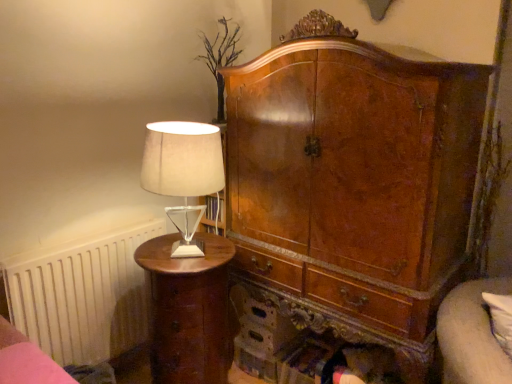
This screenshot has width=512, height=384. What do you see at coordinates (184, 174) in the screenshot? I see `satin beige lampshade at left` at bounding box center [184, 174].

Measure the distance between point (467, 356) and camera.

Point (467, 356) and camera are 3.83 feet apart from each other.

Locate an element on the screen. Image resolution: width=512 pixels, height=384 pixels. velvet beige couch at lower right is located at coordinates (472, 335).

What is the approximate height of white matte radiator at left?

white matte radiator at left is 77.67 centimeters tall.

At what (x,y) coordinates should I click in order to perform the action: click on satin beige lampshade at left. Please return your answer as a coordinate pair (x, y). The height and width of the screenshot is (384, 512). Looking at the image, I should click on (184, 174).

Is white matte radiator at left not close to satin beige lampshade at left?

white matte radiator at left is actually quite close to satin beige lampshade at left.

The image size is (512, 384). Identify the location of radiator that is on the left side of satin beige lampshade at left. (84, 296).

From the image's perspective, between white matte radiator at left and satin beige lampshade at left, who is located below?

white matte radiator at left.

Does white matte radiator at left appear on the right side of satin beige lampshade at left?

No, white matte radiator at left is not to the right of satin beige lampshade at left.

How far apart are white matte radiator at left and matte brown nightstand at left?

white matte radiator at left and matte brown nightstand at left are 14.61 inches apart from each other.

At what (x,y) coordinates should I click in order to perform the action: click on radiator above the matte brown nightstand at left (from the image's perspective). Please return your answer as a coordinate pair (x, y). Looking at the image, I should click on (84, 296).

From a real-world perspective, which is physically above, white matte radiator at left or matte brown nightstand at left?

white matte radiator at left.

Does point (159, 165) come closer to viewer compared to point (216, 377)?

Yes, point (159, 165) is closer to viewer.

Can you see satin beige lampshade at left touching matte brown nightstand at left?

They are not placed beside each other.

Can you tell me how much satin beige lampshade at left and matte brown nightstand at left differ in facing direction?

0.676 degrees separate the facing orientations of satin beige lampshade at left and matte brown nightstand at left.

Looking at this image, from the image's perspective, which object appears higher, satin beige lampshade at left or matte brown nightstand at left?

satin beige lampshade at left.

Considering the sizes of objects white matte radiator at left and wooden bed frame at lower left in the image provided, who is shorter, white matte radiator at left or wooden bed frame at lower left?

wooden bed frame at lower left is shorter.

Does white matte radiator at left come behind wooden bed frame at lower left?

Yes, it is behind wooden bed frame at lower left.

How far apart are white matte radiator at left and wooden bed frame at lower left?

white matte radiator at left and wooden bed frame at lower left are 21.65 inches apart from each other.

Can you confirm if white matte radiator at left is positioned to the right of wooden bed frame at lower left?

Incorrect, white matte radiator at left is not on the right side of wooden bed frame at lower left.

Measure the distance from matte brown nightstand at left to velvet beige couch at lower right.

matte brown nightstand at left and velvet beige couch at lower right are 35.24 inches apart from each other.

Is matte brown nightstand at left placed right next to velvet beige couch at lower right?

No, matte brown nightstand at left is not next to velvet beige couch at lower right.

Who is taller, matte brown nightstand at left or velvet beige couch at lower right?

matte brown nightstand at left is taller.

Where is `nightstand on the left of velvet beige couch at lower right`? The width and height of the screenshot is (512, 384). nightstand on the left of velvet beige couch at lower right is located at coordinates (189, 310).

Looking at this image, can you tell me how much satin beige lampshade at left and white matte radiator at left differ in facing direction?

The angle between the facing direction of satin beige lampshade at left and the facing direction of white matte radiator at left is 0.174 degrees.

Is satin beige lampshade at left inside or outside of white matte radiator at left?

satin beige lampshade at left is not enclosed by white matte radiator at left.

From the image's perspective, which is above, satin beige lampshade at left or white matte radiator at left?

satin beige lampshade at left is shown above in the image.

From a real-world perspective, who is located lower, satin beige lampshade at left or white matte radiator at left?

In real-world perspective, white matte radiator at left is lower.

Measure the distance from satin beige lampshade at left to wooden bed frame at lower left.

satin beige lampshade at left and wooden bed frame at lower left are 26.73 inches apart.

Between point (172, 160) and point (15, 357), which one is positioned in front?

The point (15, 357) is closer to the camera.

Does satin beige lampshade at left have a larger size compared to wooden bed frame at lower left?

Yes.

In the scene shown: Does satin beige lampshade at left turn towards wooden bed frame at lower left?

No, satin beige lampshade at left is not oriented towards wooden bed frame at lower left.

Image resolution: width=512 pixels, height=384 pixels. Find the location of `radiator behind the satin beige lampshade at left`. radiator behind the satin beige lampshade at left is located at coordinates (84, 296).

Image resolution: width=512 pixels, height=384 pixels. Identify the location of radiator that is above the matte brown nightstand at left (from a real-world perspective). (84, 296).

When comparing their distances from matte brown nightstand at left, does wooden bed frame at lower left or white matte radiator at left seem closer?

white matte radiator at left lies closer to matte brown nightstand at left than the other object.

Looking at the image, which one is located further to wooden bed frame at lower left, white matte radiator at left or velvet beige couch at lower right?

velvet beige couch at lower right lies further to wooden bed frame at lower left than the other object.

Based on their spatial positions, is wooden bed frame at lower left or matte brown nightstand at left further from velvet beige couch at lower right?

Based on the image, wooden bed frame at lower left appears to be further to velvet beige couch at lower right.

When comparing their distances from white matte radiator at left, does wooden bed frame at lower left or matte brown nightstand at left seem further?

wooden bed frame at lower left.

Which object lies nearer to the anchor point velvet beige couch at lower right, satin beige lampshade at left or wooden bed frame at lower left?

Based on the image, satin beige lampshade at left appears to be nearer to velvet beige couch at lower right.

Looking at the image, which one is located closer to wooden bed frame at lower left, matte brown nightstand at left or satin beige lampshade at left?

matte brown nightstand at left is positioned closer to the anchor wooden bed frame at lower left.

From the image, which object appears to be nearer to wooden bed frame at lower left, white matte radiator at left or satin beige lampshade at left?

Among the two, white matte radiator at left is located nearer to wooden bed frame at lower left.

From the image, which object appears to be farther from wooden bed frame at lower left, matte brown nightstand at left or velvet beige couch at lower right?

velvet beige couch at lower right.

At what (x,y) coordinates should I click in order to perform the action: click on bed frame between satin beige lampshade at left and matte brown nightstand at left in the up-down direction. Please return your answer as a coordinate pair (x, y). This screenshot has width=512, height=384. Looking at the image, I should click on (26, 360).

This screenshot has height=384, width=512. Find the location of `nightstand between white matte radiator at left and velvet beige couch at lower right`. nightstand between white matte radiator at left and velvet beige couch at lower right is located at coordinates (189, 310).

You are a GUI agent. You are given a task and a screenshot of the screen. Output one action in this format:
    pyautogui.click(x=<x>, y=<y>)
    Task: Click on the nightstand between wooden bed frame at lower left and velvet beige couch at lower right in the horizontal direction
    The width and height of the screenshot is (512, 384).
    Given the screenshot: What is the action you would take?
    pyautogui.click(x=189, y=310)

At what (x,y) coordinates should I click in order to perform the action: click on table lamp situated between matte brown nightstand at left and velvet beige couch at lower right from left to right. Please return your answer as a coordinate pair (x, y). The height and width of the screenshot is (384, 512). Looking at the image, I should click on (184, 174).